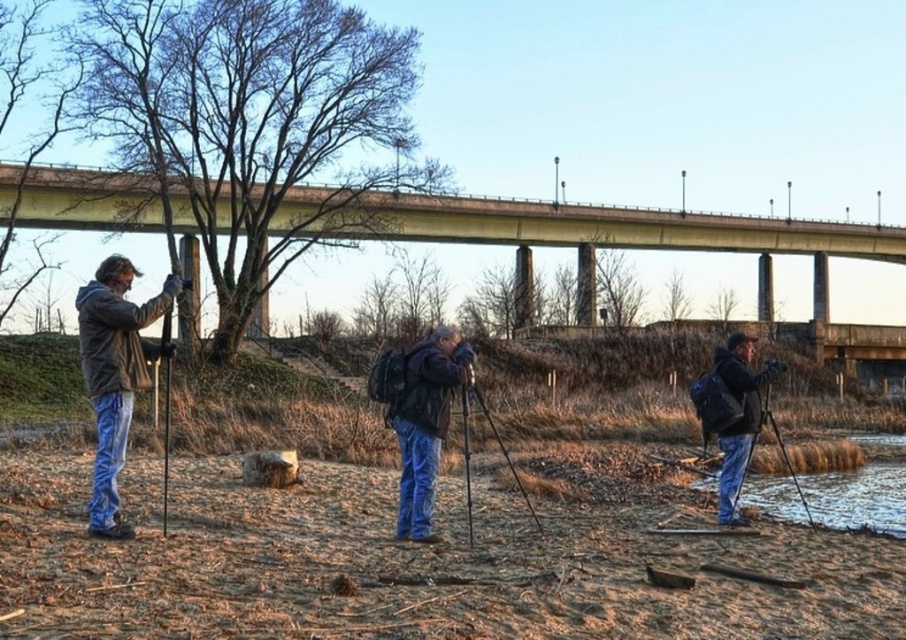
Consider the image. You are a photographer carrying a tripod that is 1 meter wide. You need to set up your equipment in the middle of the area shown. However, there is a dark blue jacket at right and a black matte tripod at center already present. Considering their positions and sizes, can you place your tripod in the center without overlapping either object?

The dark blue jacket at right might be wider than the black matte tripod at center. Since the black matte tripod at center is already occupying the central area, placing your tripod there could cause overlap. Additionally, if the dark blue jacket at right is wider, it might extend closer to the center. To avoid overlapping, you should position your tripod slightly to the left of the current center or find another open space.

You are a photographer standing at the riverside with your camera. You want to capture a photo that includes both the concrete bridge at upper center and the matte black jacket at left. Given their distance apart, will you be able to frame both in a single shot without moving your position?

The concrete bridge at upper center and matte black jacket at left are 55.39 meters apart from each other. Depending on the lens you are using, a wide angle lens might allow you to capture both in a single shot since they are 55.39 meters apart.